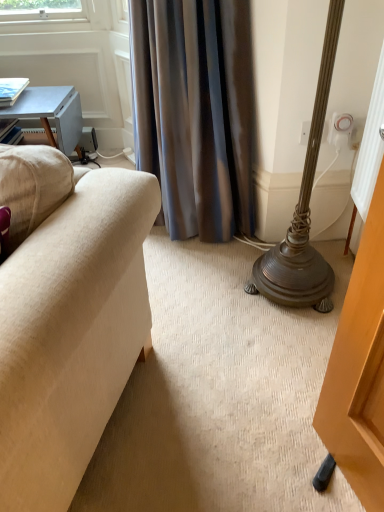
Question: Is silky gray curtain at center positioned behind light blue wooden table at upper left?

Choices:
 (A) no
 (B) yes

Answer: (A)

Question: Does silky gray curtain at center have a larger size compared to light blue wooden table at upper left?

Choices:
 (A) no
 (B) yes

Answer: (B)

Question: Does silky gray curtain at center have a greater height compared to light blue wooden table at upper left?

Choices:
 (A) no
 (B) yes

Answer: (B)

Question: From the image's perspective, does silky gray curtain at center appear lower than light blue wooden table at upper left?

Choices:
 (A) no
 (B) yes

Answer: (B)

Question: Is light blue wooden table at upper left inside silky gray curtain at center?

Choices:
 (A) no
 (B) yes

Answer: (A)

Question: Is silky gray curtain at center wider than light blue wooden table at upper left?

Choices:
 (A) yes
 (B) no

Answer: (B)

Question: Does silky gray curtain at center come behind white plastic electric outlet at upper right?

Choices:
 (A) yes
 (B) no

Answer: (B)

Question: From a real-world perspective, is silky gray curtain at center beneath white plastic electric outlet at upper right?

Choices:
 (A) no
 (B) yes

Answer: (B)

Question: Is silky gray curtain at center oriented away from white plastic electric outlet at upper right?

Choices:
 (A) no
 (B) yes

Answer: (A)

Question: Could you tell me if silky gray curtain at center is turned towards white plastic electric outlet at upper right?

Choices:
 (A) no
 (B) yes

Answer: (A)

Question: Considering the relative sizes of silky gray curtain at center and white plastic electric outlet at upper right in the image provided, is silky gray curtain at center wider than white plastic electric outlet at upper right?

Choices:
 (A) yes
 (B) no

Answer: (A)

Question: From a real-world perspective, is silky gray curtain at center on top of white plastic electric outlet at upper right?

Choices:
 (A) no
 (B) yes

Answer: (A)

Question: From a real-world perspective, is white plastic electric outlet at upper right positioned over silky gray curtain at center based on gravity?

Choices:
 (A) no
 (B) yes

Answer: (B)